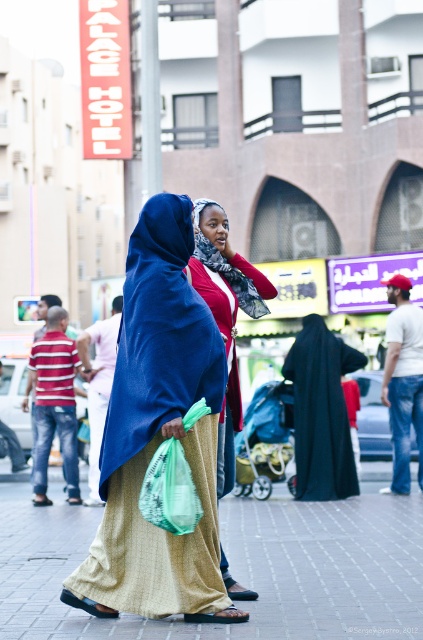
Based on the photo, does beige woven fabric at lower center appear on the right side of reddish-brown textured scarf at center?

Correct, you'll find beige woven fabric at lower center to the right of reddish-brown textured scarf at center.

Between point (348, 532) and point (266, 310), which one is positioned in front?

Point (266, 310) is more forward.

Find the location of `beige woven fabric at lower center`. beige woven fabric at lower center is located at coordinates (236, 568).

The image size is (423, 640). In order to click on beige woven fabric at lower center in this screenshot , I will do `click(236, 568)`.

Which is in front, point (107, 417) or point (189, 260)?

Point (107, 417)

Is blue woven shawl at center smaller than matte red scarf at center?

Correct, blue woven shawl at center occupies less space than matte red scarf at center.

The width and height of the screenshot is (423, 640). In order to click on blue woven shawl at center in this screenshot , I will do `click(154, 333)`.

Between point (49, 538) and point (239, 593), which one is positioned behind?

The point (49, 538) is more distant.

Is beige woven fabric at lower center positioned at the back of matte red scarf at center?

No.

Between point (93, 618) and point (192, 285), which one is positioned in front?

Point (93, 618)

This screenshot has width=423, height=640. What are the coordinates of `beige woven fabric at lower center` in the screenshot? It's located at (236, 568).